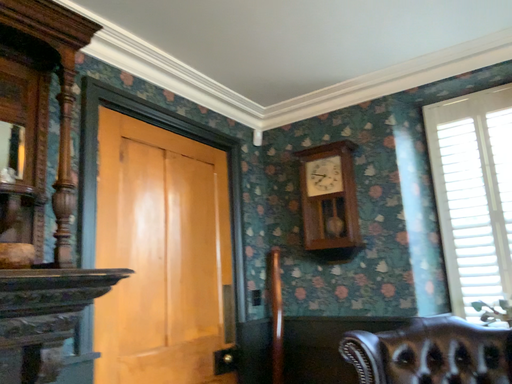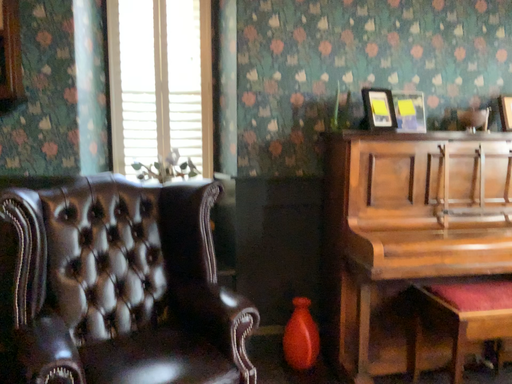
Question: How did the camera likely rotate when shooting the video?

Choices:
 (A) rotated left
 (B) rotated right

Answer: (B)